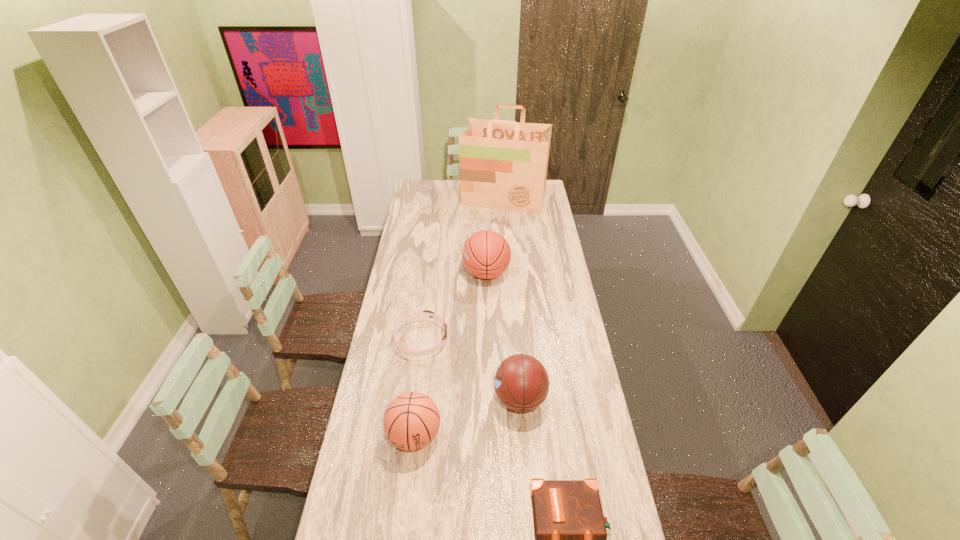
You are a GUI agent. You are given a task and a screenshot of the screen. Output one action in this format:
    pyautogui.click(x=<x>, y=<y>)
    Task: Click on the free space between the farthest basketball and the third farthest object
    Image resolution: width=960 pixels, height=540 pixels.
    Given the screenshot: What is the action you would take?
    pyautogui.click(x=454, y=306)

Where is `blank region between the grocery bag and the third farthest object`? This screenshot has height=540, width=960. blank region between the grocery bag and the third farthest object is located at coordinates (463, 269).

Locate which object is the third closest to the fourth nearest object. Please provide its 2D coordinates. Your answer should be formatted as a tuple, i.e. [(x, y)], where the tuple contains the x and y coordinates of a point satisfying the conditions above.

[(411, 421)]

The height and width of the screenshot is (540, 960). I want to click on object that stands as the closest to the nearest object, so click(x=521, y=382).

Find the location of a particular element. the second closest basketball to the farthest basketball is located at coordinates (411, 421).

Find the location of a particular element. basketball that is the third closest to the nearest object is located at coordinates (486, 254).

Locate an element on the screen. This screenshot has width=960, height=540. vacant position in the image that satisfies the following two spatial constraints: 1. on the logo side of the farthest basketball; 2. on the surface of the leftmost basketball near the brand logo is located at coordinates (489, 436).